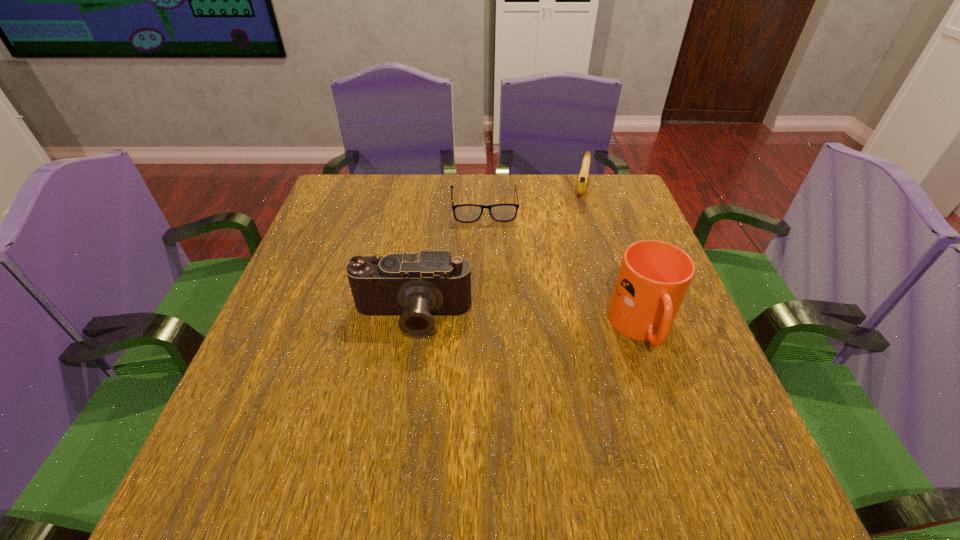
Locate an element on the screen. The height and width of the screenshot is (540, 960). vacant space located 0.190m on the front-facing side of the spectacles is located at coordinates (491, 271).

Image resolution: width=960 pixels, height=540 pixels. Identify the location of free spot located 0.130m on the front-facing side of the spectacles. (489, 255).

Identify the location of banana positioned at the far edge. (584, 171).

Where is `spectacles located in the far edge section of the desktop`? This screenshot has height=540, width=960. spectacles located in the far edge section of the desktop is located at coordinates (466, 213).

At what (x,y) coordinates should I click in order to perform the action: click on mug that is at the right edge. Please return your answer as a coordinate pair (x, y). The image size is (960, 540). Looking at the image, I should click on (654, 276).

This screenshot has height=540, width=960. I want to click on banana present at the right edge, so click(x=584, y=171).

Find the location of a particular element. The width and height of the screenshot is (960, 540). object that is at the far right corner is located at coordinates pos(584,171).

This screenshot has width=960, height=540. In order to click on vacant region at the far edge in this screenshot , I will do `click(533, 185)`.

Locate an element on the screen. Image resolution: width=960 pixels, height=540 pixels. vacant space at the near edge of the desktop is located at coordinates (459, 401).

This screenshot has width=960, height=540. In the image, there is a desktop. In order to click on free space at the left edge in this screenshot , I will do `click(345, 237)`.